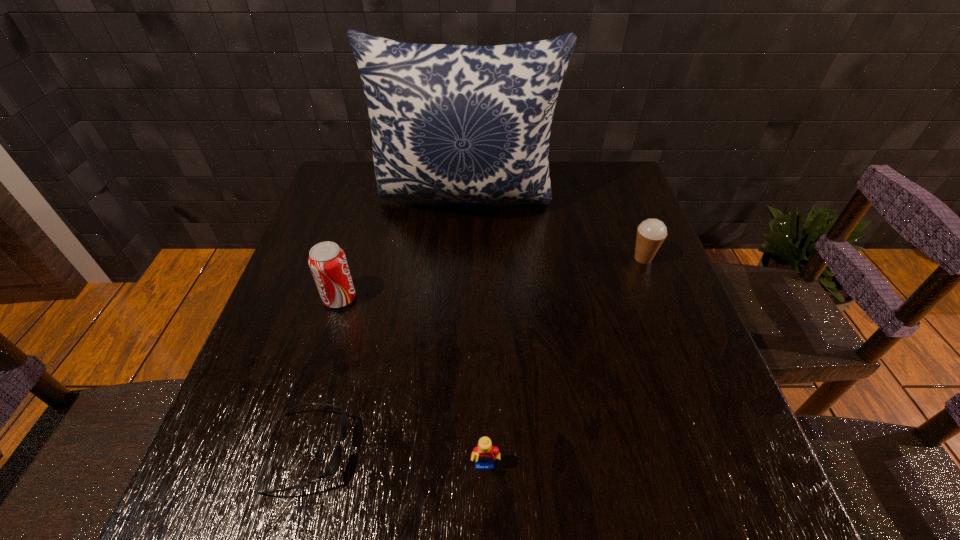
The image size is (960, 540). Find the location of `free point between the second tallest object and the farthest object`. free point between the second tallest object and the farthest object is located at coordinates (403, 249).

I want to click on free point between the tallest object and the rightmost object, so click(555, 230).

Locate an element on the screen. The image size is (960, 540). vacant point located between the tallest object and the second shortest object is located at coordinates (476, 335).

Find the location of `vacant area that lies between the soda can and the farthest object`. vacant area that lies between the soda can and the farthest object is located at coordinates (403, 249).

Where is `free space between the sunglasses and the second farthest object`? This screenshot has width=960, height=540. free space between the sunglasses and the second farthest object is located at coordinates (476, 355).

Locate an element on the screen. The image size is (960, 540). vacant space in between the fourth nearest object and the shortest object is located at coordinates (476, 355).

Identify which object is located as the nearest to the farthest object. Please provide its 2D coordinates. Your answer should be formatted as a tuple, i.e. [(x, y)], where the tuple contains the x and y coordinates of a point satisfying the conditions above.

[(651, 233)]

Identify the location of object that is the fourth closest to the fourth nearest object. (334, 464).

The width and height of the screenshot is (960, 540). I want to click on free region that satisfies the following two spatial constraints: 1. on the front surface of the farthest object; 2. on the front-facing side of the sunglasses, so click(x=457, y=452).

The image size is (960, 540). Identify the location of vacant area that satisfies the following two spatial constraints: 1. on the front surface of the tallest object; 2. on the left side of the icecream. (464, 258).